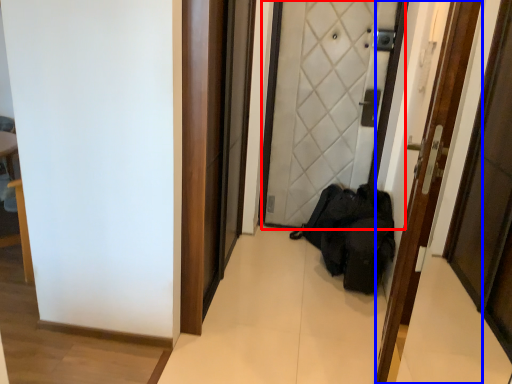
Question: Which of the following is the closest to the observer, door (highlighted by a red box) or door (highlighted by a blue box)?

Choices:
 (A) door
 (B) door

Answer: (B)